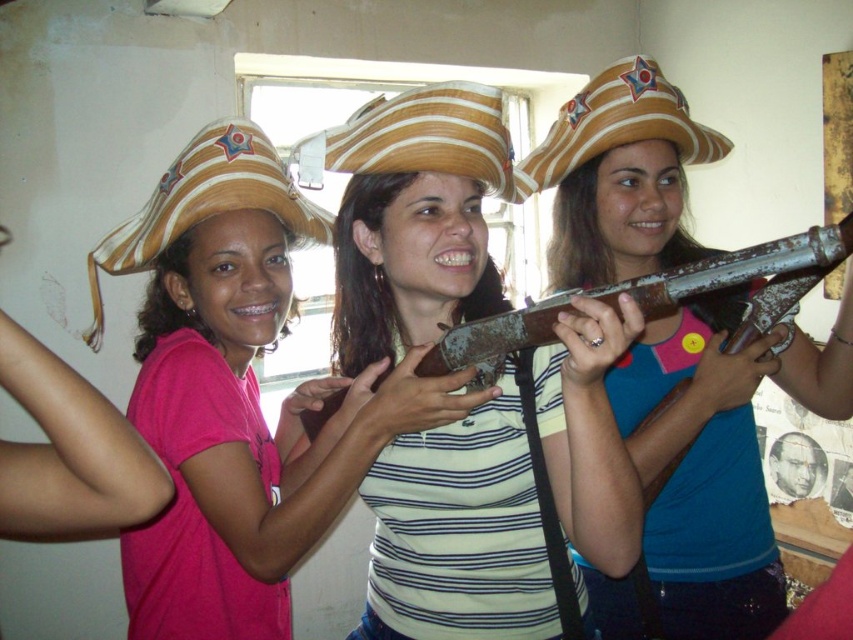
Is matte brown rifle at center above straw hat with star emblem at upper right?

No.

What do you see at coordinates (415, 218) in the screenshot?
I see `matte brown rifle at center` at bounding box center [415, 218].

This screenshot has width=853, height=640. What are the coordinates of `matte brown rifle at center` in the screenshot? It's located at (415, 218).

Between matte brown hat at center and straw cowboy hat at left, which one is positioned lower?

Positioned lower is matte brown hat at center.

Between point (827, 378) and point (274, 164), which one is positioned in front?

Point (274, 164) is more forward.

Is point (688, 321) behind point (91, 264)?

No, it is not.

At what (x,y) coordinates should I click in order to perform the action: click on matte brown hat at center. Please return your answer as a coordinate pair (x, y). Image resolution: width=853 pixels, height=640 pixels. Looking at the image, I should click on (717, 456).

Who is lower down, matte brown rifle at center or matte brown hat at center?

Positioned lower is matte brown rifle at center.

Describe the element at coordinates (415, 218) in the screenshot. I see `matte brown rifle at center` at that location.

Which is in front, point (607, 538) or point (560, 204)?

Positioned in front is point (607, 538).

This screenshot has width=853, height=640. I want to click on matte brown rifle at center, so click(415, 218).